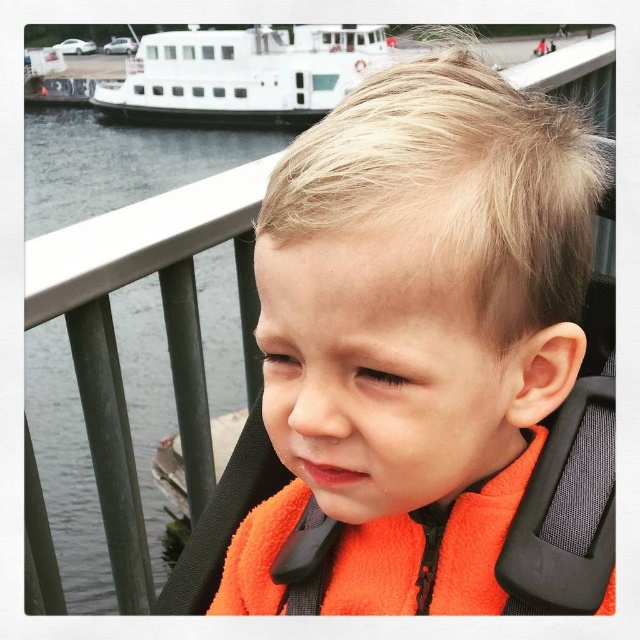
Question: Is orange fabric at center to the right of transparent water at left from the viewer's perspective?

Choices:
 (A) no
 (B) yes

Answer: (B)

Question: Is transparent water at left smaller than white matte boat at upper left?

Choices:
 (A) yes
 (B) no

Answer: (B)

Question: Which point is farther to the camera?

Choices:
 (A) transparent water at left
 (B) white matte boat at upper left
 (C) orange fabric at center

Answer: (B)

Question: In this image, where is transparent water at left located relative to white matte boat at upper left?

Choices:
 (A) left
 (B) right

Answer: (B)

Question: Which object is closer to the camera taking this photo?

Choices:
 (A) transparent water at left
 (B) orange fabric at center
 (C) white matte boat at upper left

Answer: (B)

Question: Estimate the real-world distances between objects in this image. Which object is farther from the white matte boat at upper left?

Choices:
 (A) transparent water at left
 (B) orange fabric at center

Answer: (B)